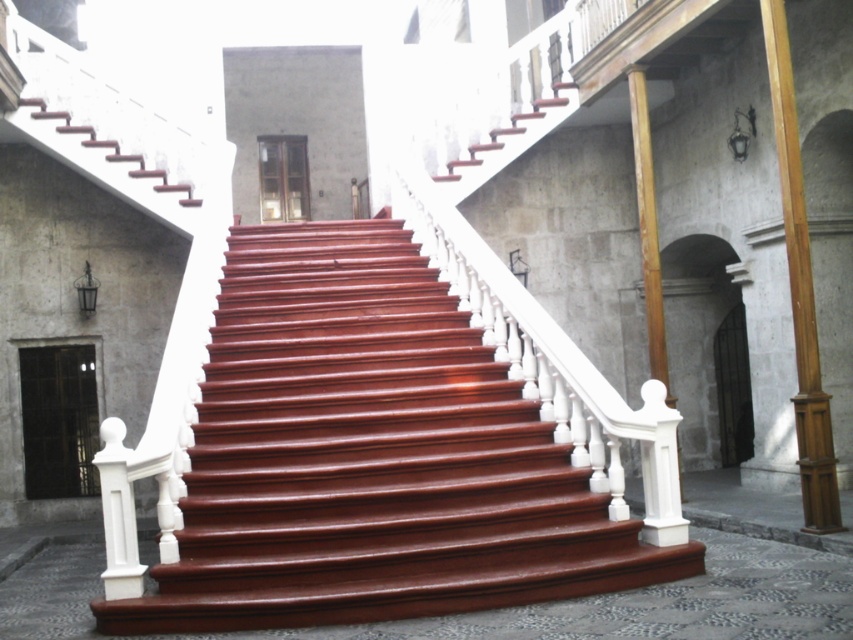
Does shiny wood stairs at center come behind wooden post at right?

No.

Describe the element at coordinates (370, 456) in the screenshot. I see `shiny wood stairs at center` at that location.

This screenshot has height=640, width=853. I want to click on shiny wood stairs at center, so click(x=370, y=456).